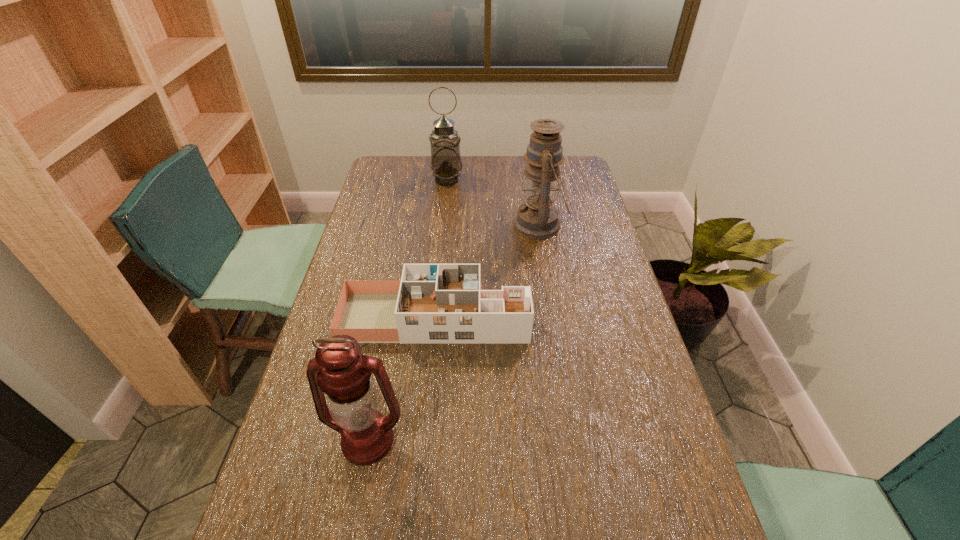
This screenshot has height=540, width=960. In order to click on free space between the farthest oil lamp and the third farthest object in this screenshot , I will do [x=441, y=248].

Image resolution: width=960 pixels, height=540 pixels. Find the location of `free space between the nearest oil lamp and the dollhouse`. free space between the nearest oil lamp and the dollhouse is located at coordinates (401, 379).

Locate an element on the screen. The image size is (960, 540). the third closest object relative to the farthest oil lamp is located at coordinates (338, 369).

Select which object is the third closest to the dollhouse. Please provide its 2D coordinates. Your answer should be formatted as a tuple, i.e. [(x, y)], where the tuple contains the x and y coordinates of a point satisfying the conditions above.

[(446, 165)]

Select which oil lamp appears as the closest to the nearest object. Please provide its 2D coordinates. Your answer should be formatted as a tuple, i.e. [(x, y)], where the tuple contains the x and y coordinates of a point satisfying the conditions above.

[(538, 218)]

This screenshot has width=960, height=540. Find the location of `the closest oil lamp relative to the nearest oil lamp`. the closest oil lamp relative to the nearest oil lamp is located at coordinates (538, 218).

Find the location of a particular element. free space that satisfies the following two spatial constraints: 1. on the back side of the farthest object; 2. on the left side of the nearest object is located at coordinates (419, 180).

Identify the location of vacant space that satisfies the following two spatial constraints: 1. on the front side of the second farthest object; 2. on the right side of the farthest oil lamp. The width and height of the screenshot is (960, 540). (443, 225).

This screenshot has width=960, height=540. In order to click on vacant space that satisfies the following two spatial constraints: 1. on the back side of the nearest oil lamp; 2. on the left side of the farthest object in this screenshot , I will do `click(419, 180)`.

Identify the location of blank space that satisfies the following two spatial constraints: 1. on the back side of the nearest object; 2. on the left side of the second farthest object. The height and width of the screenshot is (540, 960). (410, 225).